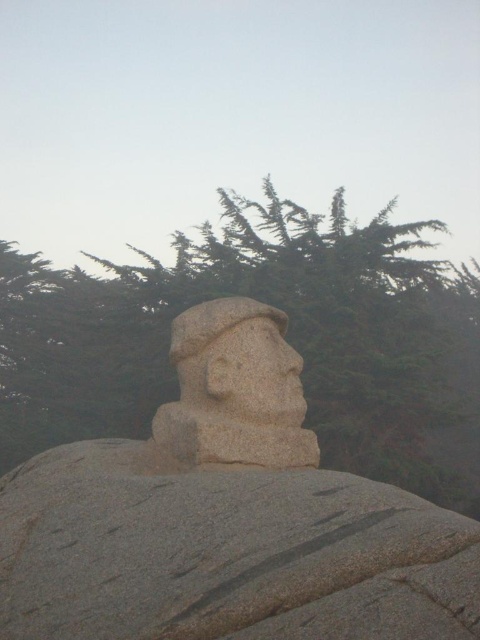
Is green textured tree at upper center positioned in front of granite statue head at center?

No, it is behind granite statue head at center.

Is the position of green textured tree at upper center more distant than that of granite statue head at center?

Yes.

Does point (297, 221) come closer to viewer compared to point (300, 384)?

No, it is behind (300, 384).

The width and height of the screenshot is (480, 640). I want to click on green textured tree at upper center, so click(x=288, y=340).

Image resolution: width=480 pixels, height=640 pixels. What do you see at coordinates (288, 340) in the screenshot?
I see `green textured tree at upper center` at bounding box center [288, 340].

Between green textured tree at upper center and granite statue at center, which one has more height?

With more height is green textured tree at upper center.

Describe the element at coordinates (288, 340) in the screenshot. The width and height of the screenshot is (480, 640). I see `green textured tree at upper center` at that location.

This screenshot has width=480, height=640. I want to click on green textured tree at upper center, so click(x=288, y=340).

Who is more forward, [33,374] or [184,515]?

Positioned in front is point [184,515].

Is green textured tree at upper center positioned at the back of granite boulder at center?

Yes, it is behind granite boulder at center.

This screenshot has width=480, height=640. Find the location of `green textured tree at upper center`. green textured tree at upper center is located at coordinates [x=288, y=340].